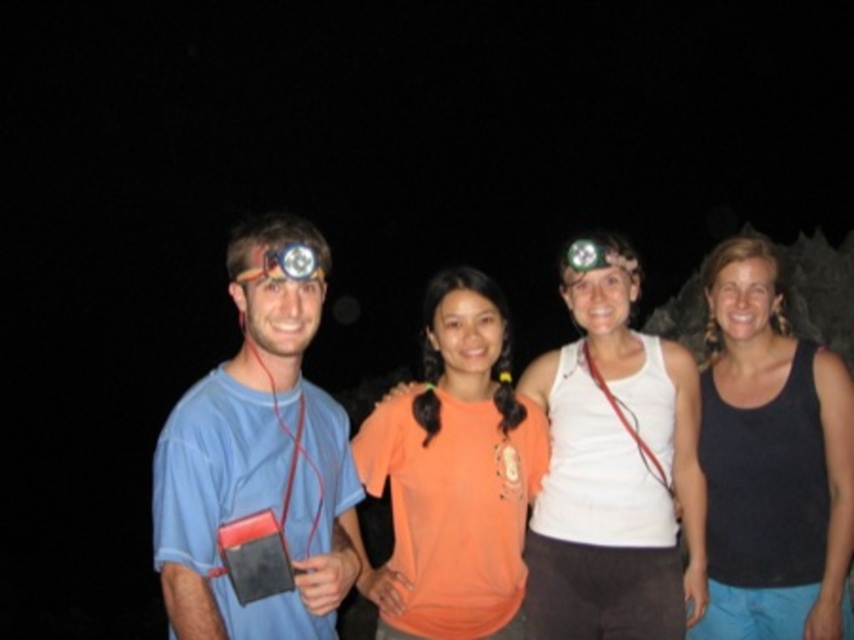
Is matte blue t-shirt at left wider than orange matte t-shirt at center?

Incorrect, matte blue t-shirt at left's width does not surpass orange matte t-shirt at center's.

Describe the element at coordinates (258, 460) in the screenshot. This screenshot has width=854, height=640. I see `matte blue t-shirt at left` at that location.

Locate an element on the screen. Image resolution: width=854 pixels, height=640 pixels. matte blue t-shirt at left is located at coordinates [258, 460].

Does matte blue t-shirt at left have a lesser height compared to black tank top at right?

Indeed, matte blue t-shirt at left has a lesser height compared to black tank top at right.

Who is higher up, matte blue t-shirt at left or black tank top at right?

matte blue t-shirt at left is above.

Between point (307, 234) and point (776, 560), which one is positioned behind?

The point (776, 560) is more distant.

Find the location of a particular element. Image resolution: width=854 pixels, height=640 pixels. matte blue t-shirt at left is located at coordinates (258, 460).

Is orange cotton shirt at center bigger than black tank top at right?

Actually, orange cotton shirt at center might be smaller than black tank top at right.

Based on the photo, who is more forward, (689,436) or (776,627)?

Point (776,627) is more forward.

Is point (559, 408) in front of point (718, 438)?

No, it is behind (718, 438).

You are a GUI agent. You are given a task and a screenshot of the screen. Output one action in this format:
    pyautogui.click(x=<x>, y=<y>)
    Task: Click on the orange cotton shirt at center
    The width and height of the screenshot is (854, 640).
    Given the screenshot: What is the action you would take?
    pyautogui.click(x=613, y=467)